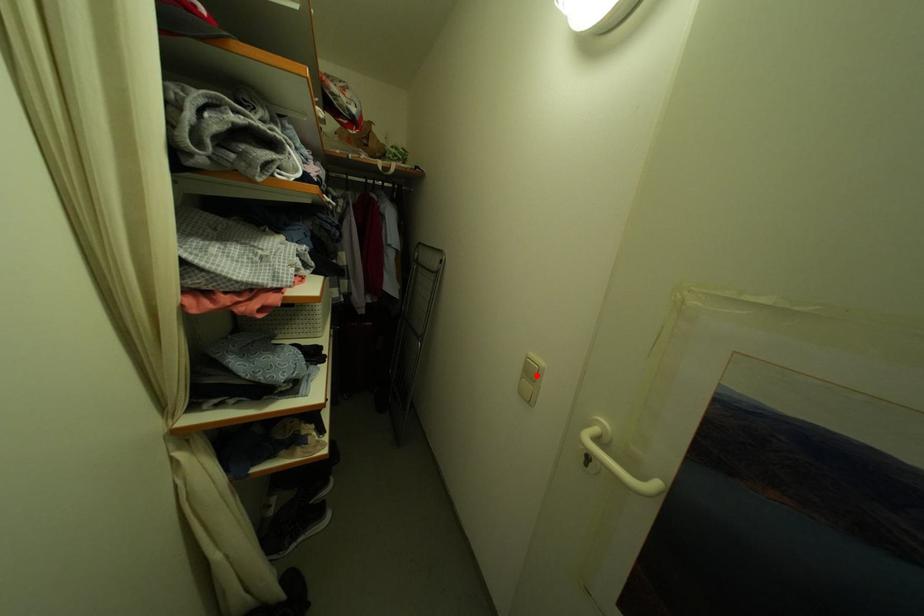
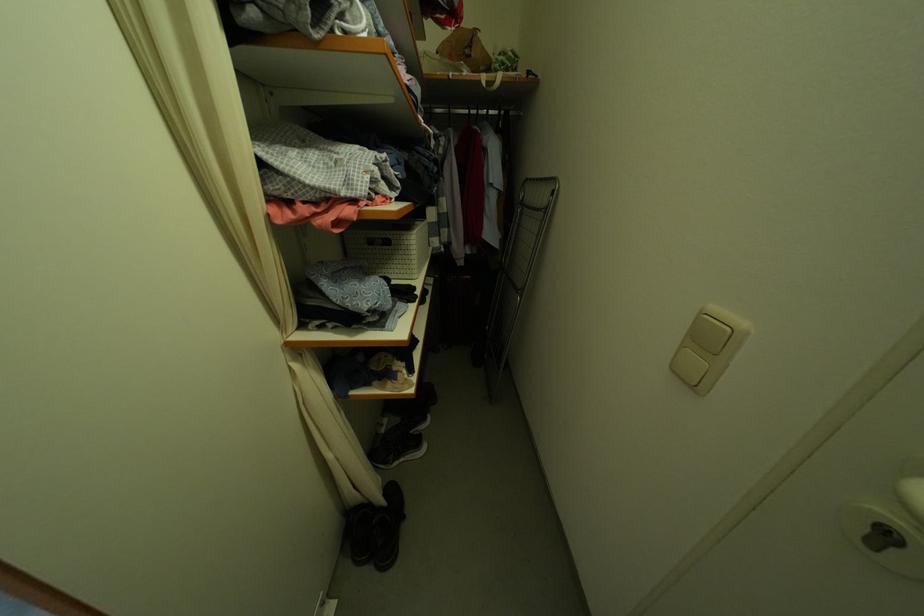
In the second image, find the point that corresponds to the highlighted location in the first image.

(713, 342)